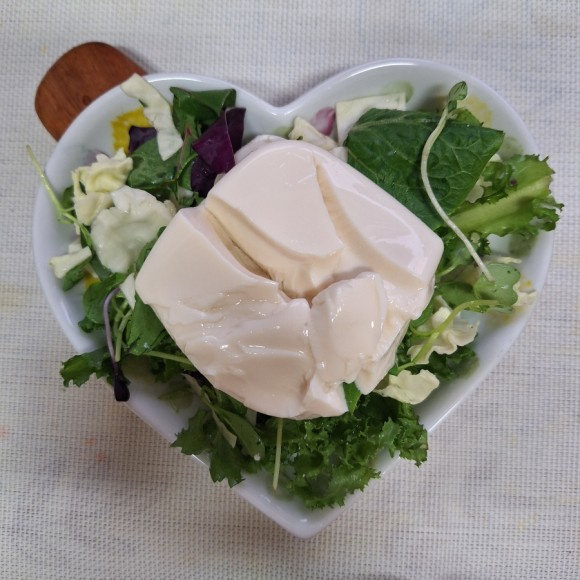
This screenshot has width=580, height=580. Identify the location of plant decoration showing through table cloth. click(77, 524).